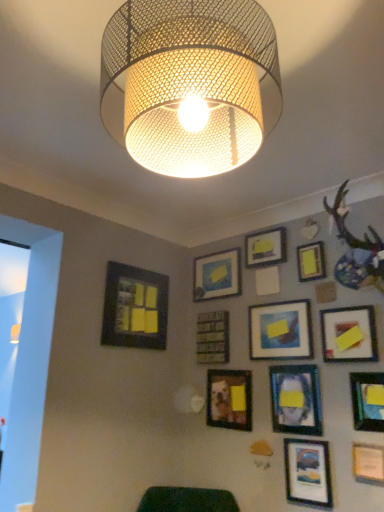
Identify the location of matte black picture frame at lower right, marked as the sixth picture frame in a right-to-left arrangement. (296, 399).

This screenshot has height=512, width=384. Describe the element at coordinates (296, 399) in the screenshot. I see `matte black picture frame at lower right, marked as the sixth picture frame in a right-to-left arrangement` at that location.

What do you see at coordinates (308, 472) in the screenshot?
I see `matte black picture frame at lower right, the 8th picture frame viewed from the left` at bounding box center [308, 472].

This screenshot has width=384, height=512. What are the coordinates of `yellow matte picture frame at upper right, acting as the 9th picture frame starting from the left` in the screenshot? It's located at (311, 261).

Considering the relative sizes of wooden frame at center, which is the 11th picture frame in right-to-left order, and matte white picture frame at lower right, the eleventh picture frame from the left, in the image provided, is wooden frame at center, which is the 11th picture frame in right-to-left order, wider than matte white picture frame at lower right, the eleventh picture frame from the left,?

No.

Is wooden frame at center, which is the 11th picture frame in right-to-left order, positioned before matte white picture frame at lower right, the eleventh picture frame from the left?

No, wooden frame at center, which is the 11th picture frame in right-to-left order, is behind matte white picture frame at lower right, the eleventh picture frame from the left.

Considering the sizes of objects wooden frame at center, which is the 11th picture frame in right-to-left order, and matte white picture frame at lower right, the eleventh picture frame from the left, in the image provided, who is taller, wooden frame at center, which is the 11th picture frame in right-to-left order, or matte white picture frame at lower right, the eleventh picture frame from the left,?

Standing taller between the two is wooden frame at center, which is the 11th picture frame in right-to-left order.

Measure the distance between yellow matte picture frame at upper center, positioned as the eighth picture frame in right-to-left order, and metal mesh lampshade at upper center.

They are 1.55 meters apart.

Is yellow matte picture frame at upper center, positioned as the eighth picture frame in right-to-left order, facing towards metal mesh lampshade at upper center?

Yes, yellow matte picture frame at upper center, positioned as the eighth picture frame in right-to-left order, is facing metal mesh lampshade at upper center.

From the image's perspective, between yellow matte picture frame at upper center, positioned as the eighth picture frame in right-to-left order, and metal mesh lampshade at upper center, who is located below?

yellow matte picture frame at upper center, positioned as the eighth picture frame in right-to-left order, from the image's perspective.

Looking at this image, from a real-world perspective, which is physically above, yellow matte picture frame at upper center, which appears as the fifth picture frame when viewed from the left, or metal mesh lampshade at upper center?

From a 3D spatial view, yellow matte picture frame at upper center, which appears as the fifth picture frame when viewed from the left, is above.

Is matte white picture frame at lower right, the second picture frame positioned from the right, beside matte black picture frame at lower right, the 12th picture frame viewed from the left?

There is a gap between matte white picture frame at lower right, the second picture frame positioned from the right, and matte black picture frame at lower right, the 12th picture frame viewed from the left.

Locate an element on the screen. This screenshot has height=512, width=384. the 3rd picture frame positioned above the matte white picture frame at lower right, the eleventh picture frame from the left (from the image's perspective) is located at coordinates (368, 401).

From the image's perspective, does matte white picture frame at lower right, the eleventh picture frame from the left, appear lower than matte black picture frame at lower right, the 12th picture frame viewed from the left?

Yes.

Could you tell me if matte white picture frame at lower right, the eleventh picture frame from the left, is turned towards matte black picture frame at lower right, the 1th picture frame viewed from the right?

No, matte white picture frame at lower right, the eleventh picture frame from the left, is not turned towards matte black picture frame at lower right, the 1th picture frame viewed from the right.

From the picture: Is wooden frame at center, the 2th picture frame viewed from the left, turned away from matte blue painting at center, the 7th picture frame viewed from the right?

No, wooden frame at center, the 2th picture frame viewed from the left, is not facing the opposite direction of matte blue painting at center, the 7th picture frame viewed from the right.

Measure the distance between wooden frame at center, which is the 11th picture frame in right-to-left order, and matte blue painting at center, the 7th picture frame viewed from the right.

A distance of 33.14 centimeters exists between wooden frame at center, which is the 11th picture frame in right-to-left order, and matte blue painting at center, the 7th picture frame viewed from the right.

Which is in front, wooden frame at center, the 2th picture frame viewed from the left, or matte blue painting at center, which is the 6th picture frame in left-to-right order?

matte blue painting at center, which is the 6th picture frame in left-to-right order, is more forward.

Considering the sizes of objects wooden frame at center, the 2th picture frame viewed from the left, and matte blue painting at center, which is the 6th picture frame in left-to-right order, in the image provided, who is smaller, wooden frame at center, the 2th picture frame viewed from the left, or matte blue painting at center, which is the 6th picture frame in left-to-right order,?

wooden frame at center, the 2th picture frame viewed from the left.

How many degrees apart are the facing directions of matte yellow paper at upper center, arranged as the 3th picture frame when viewed from the left, and matte black picture frame at lower right, the seventh picture frame positioned from the left?

The angle between the facing direction of matte yellow paper at upper center, arranged as the 3th picture frame when viewed from the left, and the facing direction of matte black picture frame at lower right, the seventh picture frame positioned from the left, is 0.683 degrees.

From the image's perspective, between matte yellow paper at upper center, arranged as the 3th picture frame when viewed from the left, and matte black picture frame at lower right, marked as the sixth picture frame in a right-to-left arrangement, which one is located above?

matte yellow paper at upper center, arranged as the 3th picture frame when viewed from the left, appears higher in the image.

Considering the positions of objects matte yellow paper at upper center, which is the tenth picture frame from right to left, and matte black picture frame at lower right, the seventh picture frame positioned from the left, in the image provided, who is in front, matte yellow paper at upper center, which is the tenth picture frame from right to left, or matte black picture frame at lower right, the seventh picture frame positioned from the left,?

matte black picture frame at lower right, the seventh picture frame positioned from the left, is more forward.

Considering the sizes of matte yellow paper at upper center, which is the tenth picture frame from right to left, and matte black picture frame at lower right, marked as the sixth picture frame in a right-to-left arrangement, in the image, is matte yellow paper at upper center, which is the tenth picture frame from right to left, wider or thinner than matte black picture frame at lower right, marked as the sixth picture frame in a right-to-left arrangement,?

Considering their sizes, matte yellow paper at upper center, which is the tenth picture frame from right to left, looks broader than matte black picture frame at lower right, marked as the sixth picture frame in a right-to-left arrangement.

What's the angular difference between metal mesh lampshade at upper center and matte black picture frame at lower left, which appears as the twelfth picture frame when viewed from the right,'s facing directions?

The facing directions of metal mesh lampshade at upper center and matte black picture frame at lower left, which appears as the twelfth picture frame when viewed from the right, are 168 degrees apart.

Is point (213, 101) positioned after point (125, 282)?

No, (213, 101) is in front of (125, 282).

Looking at this image, can you confirm if metal mesh lampshade at upper center is positioned to the left of matte black picture frame at lower left, the 1th picture frame when ordered from left to right?

In fact, metal mesh lampshade at upper center is to the right of matte black picture frame at lower left, the 1th picture frame when ordered from left to right.

Locate an element on the screen. This screenshot has width=384, height=512. lamp that is above the matte black picture frame at lower left, the 1th picture frame when ordered from left to right (from the image's perspective) is located at coordinates (190, 83).

The height and width of the screenshot is (512, 384). Find the location of `the 9th picture frame directly above the matte black picture frame at lower right, the 8th picture frame viewed from the left (from a real-world perspective)`. the 9th picture frame directly above the matte black picture frame at lower right, the 8th picture frame viewed from the left (from a real-world perspective) is located at coordinates (311, 261).

Visually, is matte black picture frame at lower right, the 8th picture frame viewed from the left, positioned to the left or to the right of yellow matte picture frame at upper right, acting as the 9th picture frame starting from the left?

From the image, it's evident that matte black picture frame at lower right, the 8th picture frame viewed from the left, is to the left of yellow matte picture frame at upper right, acting as the 9th picture frame starting from the left.

In the scene shown: Considering the relative sizes of matte black picture frame at lower right, the 8th picture frame viewed from the left, and yellow matte picture frame at upper right, arranged as the fourth picture frame when viewed from the right, in the image provided, is matte black picture frame at lower right, the 8th picture frame viewed from the left, shorter than yellow matte picture frame at upper right, arranged as the fourth picture frame when viewed from the right,?

In fact, matte black picture frame at lower right, the 8th picture frame viewed from the left, may be taller than yellow matte picture frame at upper right, arranged as the fourth picture frame when viewed from the right.

Identify the location of picture frame that is the 9th one when counting forward from the wooden frame at center, which is the 11th picture frame in right-to-left order. The width and height of the screenshot is (384, 512). (368, 463).

At what (x,y) coordinates should I click in order to perform the action: click on picture frame that is the 4th one when counting rightward from the metal mesh lampshade at upper center. Please return your answer as a coordinate pair (x, y). Image resolution: width=384 pixels, height=512 pixels. Looking at the image, I should click on (265, 248).

Estimate the real-world distances between objects in this image. Which object is closer to matte black picture frame at lower left, the 1th picture frame when ordered from left to right, matte yellow paper at upper center, arranged as the 3th picture frame when viewed from the left, or matte black picture frame at lower right, the 12th picture frame viewed from the left?

matte yellow paper at upper center, arranged as the 3th picture frame when viewed from the left, lies closer to matte black picture frame at lower left, the 1th picture frame when ordered from left to right, than the other object.

Estimate the real-world distances between objects in this image. Which object is further from matte black picture frame at lower right, the 12th picture frame viewed from the left, wooden frame at center, which is the 11th picture frame in right-to-left order, or yellow matte picture frame at upper right, the 10th picture frame positioned from the left?

wooden frame at center, which is the 11th picture frame in right-to-left order.

From the image, which object appears to be farther from matte black picture frame at lower right, the 1th picture frame viewed from the right, yellow matte picture frame at upper center, which appears as the fifth picture frame when viewed from the left, or matte black picture frame at center, which is the 4th picture frame in left-to-right order?

yellow matte picture frame at upper center, which appears as the fifth picture frame when viewed from the left, is positioned further to the anchor matte black picture frame at lower right, the 1th picture frame viewed from the right.

When comparing their distances from matte black picture frame at lower right, the seventh picture frame positioned from the left, does wooden frame at center, which is the 11th picture frame in right-to-left order, or matte black picture frame at lower right, the 8th picture frame viewed from the left, seem further?

The object further to matte black picture frame at lower right, the seventh picture frame positioned from the left, is wooden frame at center, which is the 11th picture frame in right-to-left order.

Based on their spatial positions, is metal mesh lampshade at upper center or matte white picture frame at lower right, the second picture frame positioned from the right, further from matte black picture frame at lower right, the 1th picture frame viewed from the right?

metal mesh lampshade at upper center.

Estimate the real-world distances between objects in this image. Which object is further from matte black picture frame at center, which ranks as the 9th picture frame in right-to-left order, yellow matte picture frame at upper right, the 10th picture frame positioned from the left, or matte black picture frame at lower right, the 8th picture frame viewed from the left?

Based on the image, yellow matte picture frame at upper right, the 10th picture frame positioned from the left, appears to be further to matte black picture frame at center, which ranks as the 9th picture frame in right-to-left order.

When comparing their distances from yellow matte picture frame at upper center, positioned as the eighth picture frame in right-to-left order, does matte black picture frame at lower left, which appears as the twelfth picture frame when viewed from the right, or wooden frame at center, the 2th picture frame viewed from the left, seem closer?

Among the two, wooden frame at center, the 2th picture frame viewed from the left, is located nearer to yellow matte picture frame at upper center, positioned as the eighth picture frame in right-to-left order.

Considering their positions, is matte black picture frame at center, which ranks as the 9th picture frame in right-to-left order, positioned closer to matte blue painting at center, the 7th picture frame viewed from the right, than matte black picture frame at lower right, positioned as the 5th picture frame in right-to-left order?

matte black picture frame at center, which ranks as the 9th picture frame in right-to-left order.

This screenshot has width=384, height=512. Identify the location of picture frame situated between matte black picture frame at lower left, the 1th picture frame when ordered from left to right, and matte yellow paper at upper center, which is the tenth picture frame from right to left, from left to right. (212, 337).